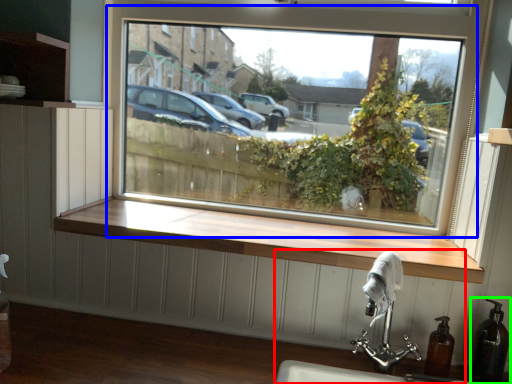
Question: Based on their relative distances, which object is farther from sink (highlighted by a red box)? Choose from window (highlighted by a blue box) and soap dispenser (highlighted by a green box).

Choices:
 (A) window
 (B) soap dispenser

Answer: (A)